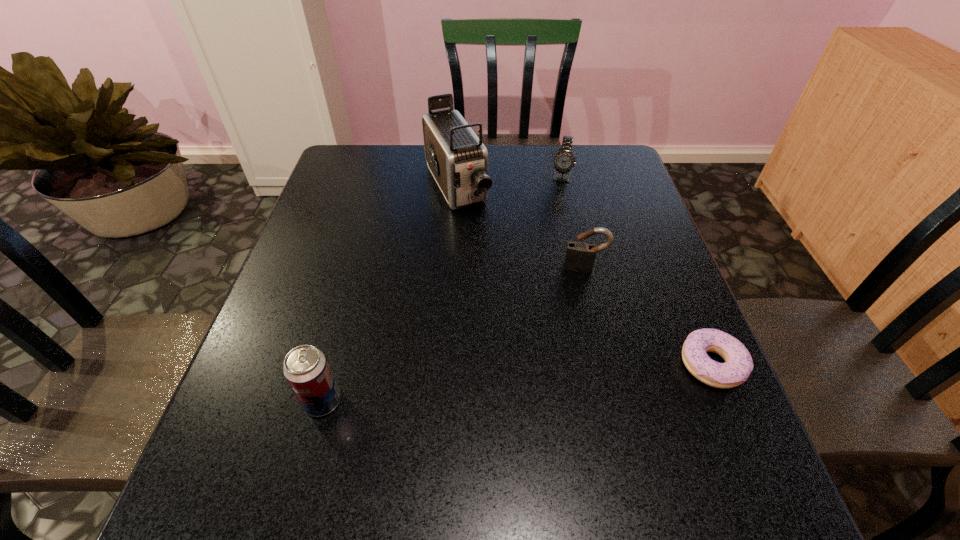
Image resolution: width=960 pixels, height=540 pixels. Find the location of `beer can`. beer can is located at coordinates (306, 369).

This screenshot has width=960, height=540. I want to click on the rightmost object, so click(738, 365).

Locate an element on the screen. Image resolution: width=960 pixels, height=540 pixels. doughnut is located at coordinates (x=738, y=365).

The image size is (960, 540). What are the coordinates of `watch` in the screenshot? It's located at (564, 160).

You are a GUI agent. You are given a task and a screenshot of the screen. Output one action in this format:
    pyautogui.click(x=<x>, y=<y>)
    Task: Click on the third farthest object
    
    Given the screenshot: What is the action you would take?
    pyautogui.click(x=580, y=256)

The image size is (960, 540). I want to click on camcorder, so click(x=458, y=160).

Locate an element on the screen. The height and width of the screenshot is (540, 960). the fourth object from right to left is located at coordinates (458, 160).

Image resolution: width=960 pixels, height=540 pixels. Find the location of `blank space located 0.370m on the back of the beer can`. blank space located 0.370m on the back of the beer can is located at coordinates pos(363,253).

At what (x,y) coordinates should I click in order to perform the action: click on vacant area located 0.110m on the left of the doughnut. Please return your answer as a coordinate pair (x, y). Looking at the image, I should click on (624, 364).

This screenshot has width=960, height=540. I want to click on vacant space situated on the face of the watch, so click(547, 253).